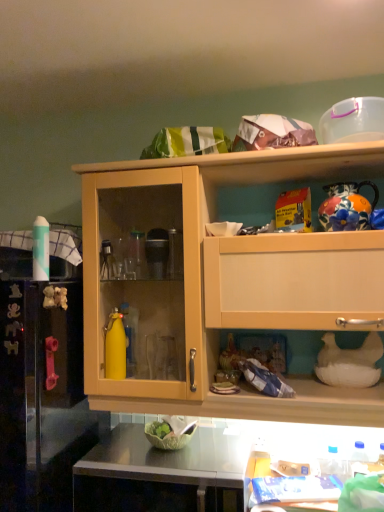
Question: In terms of size, does yellow rubber glove at left appear bigger or smaller than white glossy table at lower center?

Choices:
 (A) small
 (B) big

Answer: (B)

Question: Would you say yellow rubber glove at left is to the left or to the right of white glossy table at lower center in the picture?

Choices:
 (A) left
 (B) right

Answer: (A)

Question: Which object is positioned farthest from the metallic stainless steel counter top at lower center?

Choices:
 (A) light wood cabinet at upper center
 (B) yellow rubber glove at left
 (C) white glossy table at lower center

Answer: (A)

Question: Estimate the real-world distances between objects in this image. Which object is closer to the white glossy table at lower center?

Choices:
 (A) yellow rubber glove at left
 (B) metallic stainless steel counter top at lower center
 (C) light wood cabinet at upper center

Answer: (B)